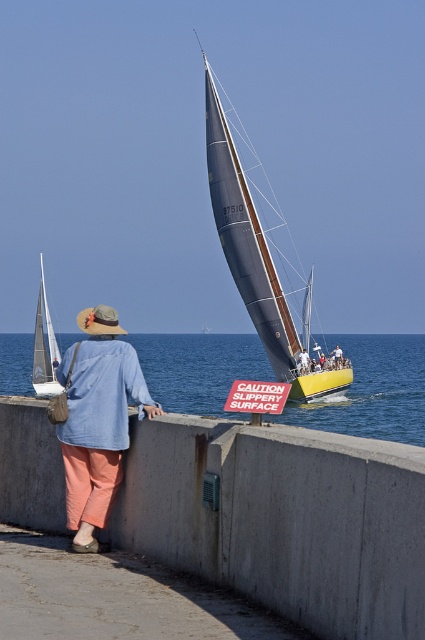
Question: Does concrete at center have a larger size compared to denim shirt at center?

Choices:
 (A) yes
 (B) no

Answer: (B)

Question: Is denim shirt at center above shiny blue sailboat at center?

Choices:
 (A) yes
 (B) no

Answer: (B)

Question: Is shiny blue sailboat at center above white glossy sailboat at left?

Choices:
 (A) yes
 (B) no

Answer: (A)

Question: Which of the following is the farthest from the observer?

Choices:
 (A) white glossy sailboat at left
 (B) concrete at center
 (C) shiny blue sailboat at center

Answer: (A)

Question: Which point appears farthest from the camera in this image?

Choices:
 (A) (115, 337)
 (B) (339, 352)
 (C) (302, 353)

Answer: (B)

Question: Which object is closer to the camera taking this photo?

Choices:
 (A) light blue shirt at upper left
 (B) white fabric shirt at center
 (C) concrete at center
 (D) white glossy sailboat at left

Answer: (C)